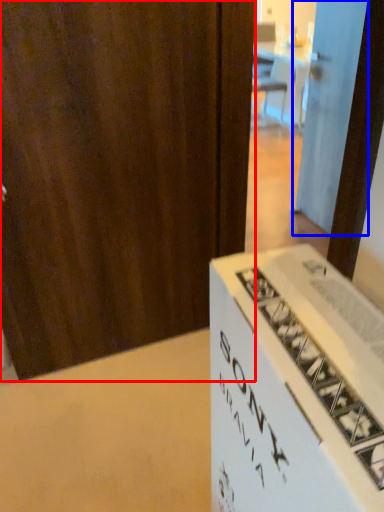
Question: Which point is closer to the camera, door (highlighted by a red box) or door (highlighted by a blue box)?

Choices:
 (A) door
 (B) door

Answer: (A)